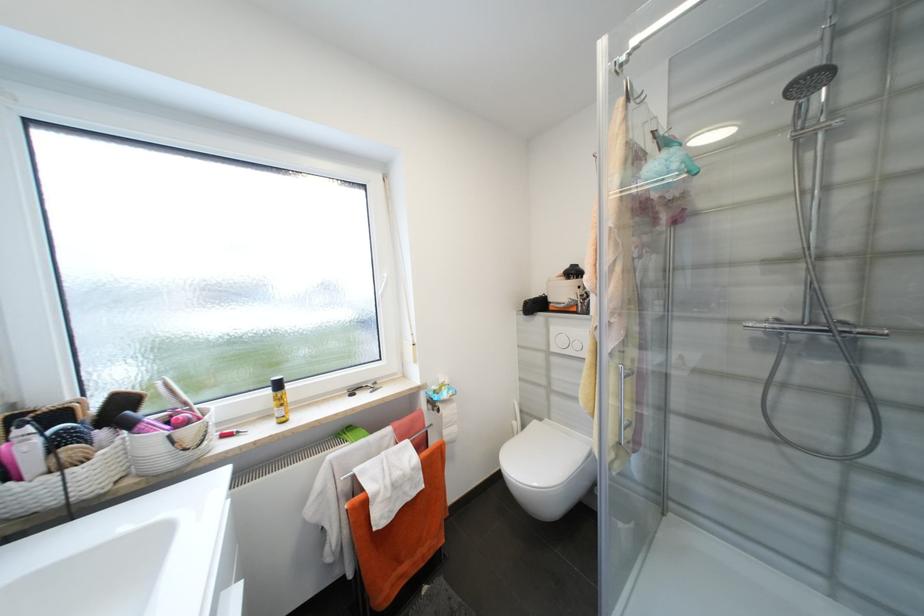
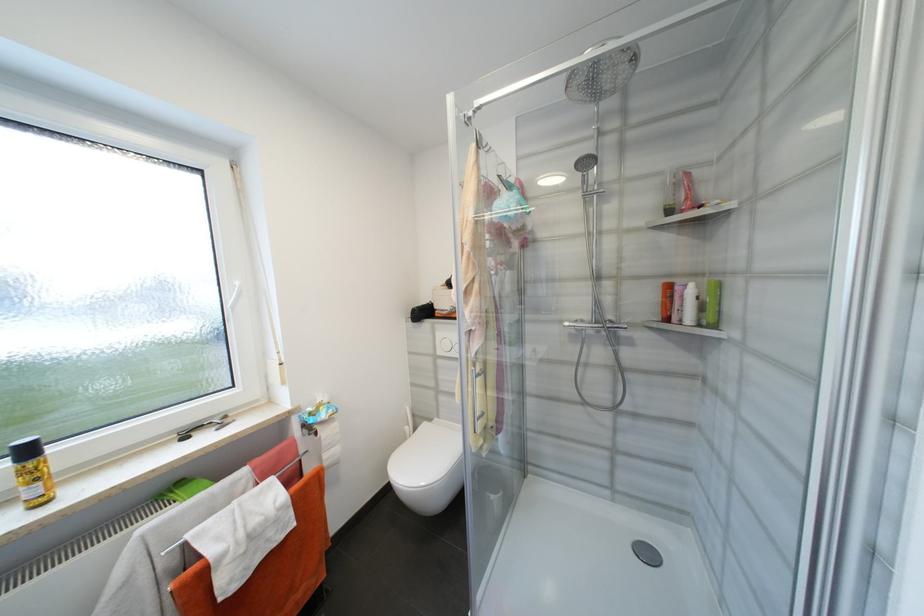
Locate, in the second image, the point that corresponds to pixel 284 386 in the first image.

(33, 453)